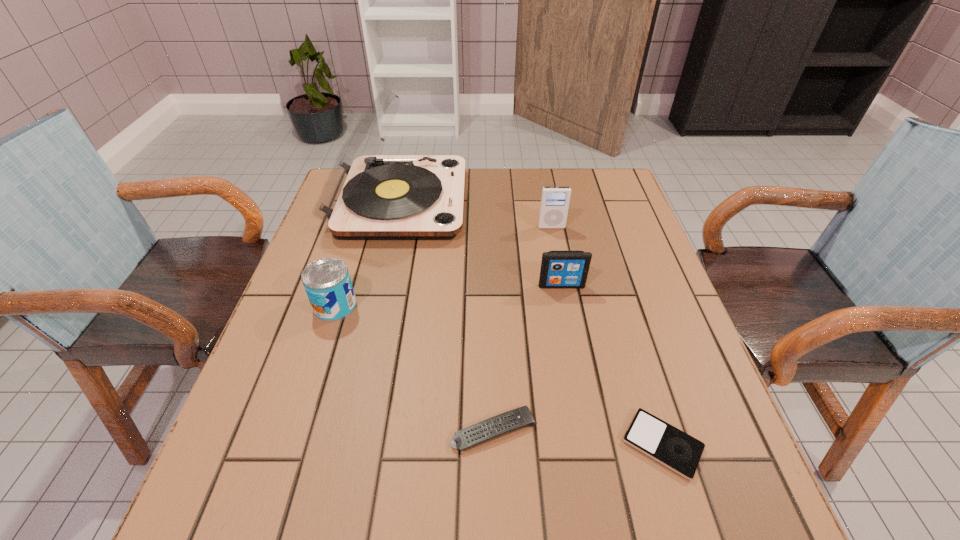
Where is `record player`? The width and height of the screenshot is (960, 540). record player is located at coordinates (366, 196).

Image resolution: width=960 pixels, height=540 pixels. In order to click on the tallest iPod in this screenshot , I will do `click(554, 205)`.

Locate an element on the screen. the second tallest object is located at coordinates (554, 205).

Image resolution: width=960 pixels, height=540 pixels. I want to click on the second farthest iPod, so click(559, 269).

Where is `the fourth nearest object`? The width and height of the screenshot is (960, 540). the fourth nearest object is located at coordinates click(x=559, y=269).

Locate an element on the screen. Image resolution: width=960 pixels, height=540 pixels. can is located at coordinates (327, 282).

The height and width of the screenshot is (540, 960). Find the location of `the second shortest object`. the second shortest object is located at coordinates (520, 417).

Where is `the rightmost object`? The height and width of the screenshot is (540, 960). the rightmost object is located at coordinates (678, 451).

Identify the location of the shortest iPod. This screenshot has height=540, width=960. (678, 451).

Identify the location of free space located 0.170m with the tonearm facing the front of the record player. (521, 202).